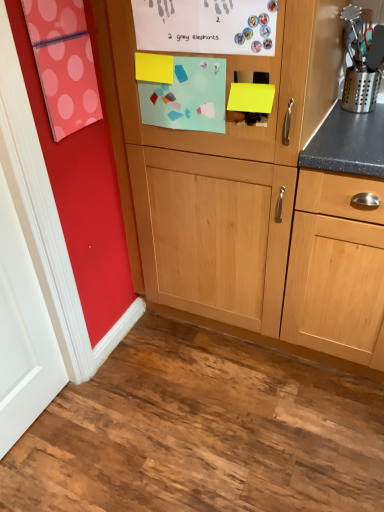
You are a GUI agent. You are given a task and a screenshot of the screen. Output one action in this format:
    pyautogui.click(x=<x>, y=<y>)
    Task: Click on the wooden cabinet at center
    The image size is (384, 512).
    Given the screenshot: What is the action you would take?
    pyautogui.click(x=229, y=167)

What do you see at coordinates (229, 167) in the screenshot?
I see `wooden cabinet at center` at bounding box center [229, 167].

Where is `white matte door at left`? Image resolution: width=384 pixels, height=512 pixels. white matte door at left is located at coordinates (23, 333).

What do you see at coordinates (23, 333) in the screenshot? I see `white matte door at left` at bounding box center [23, 333].

The height and width of the screenshot is (512, 384). What are the coordinates of `wooden cabinet at center` in the screenshot? It's located at (229, 167).

Which object is positioned more to the right, wooden cabinet at center or white matte door at left?

wooden cabinet at center.

Which object is closer to the camera taking this photo, wooden cabinet at center or white matte door at left?

Positioned in front is white matte door at left.

Which is closer to the camera, (126, 9) or (25, 260)?

Positioned in front is point (126, 9).

Looking at this image, from the image's perspective, is wooden cabinet at center above white matte door at left?

Indeed, from the image's perspective, wooden cabinet at center is shown above white matte door at left.

From a real-world perspective, who is located higher, wooden cabinet at center or white matte door at left?

wooden cabinet at center, from a real-world perspective.

Considering the relative sizes of wooden cabinet at center and white matte door at left in the image provided, is wooden cabinet at center thinner than white matte door at left?

Incorrect, the width of wooden cabinet at center is not less than that of white matte door at left.

Is wooden cabinet at center shorter than white matte door at left?

No, wooden cabinet at center is not shorter than white matte door at left.

Considering the sizes of objects wooden cabinet at center and white matte door at left in the image provided, who is bigger, wooden cabinet at center or white matte door at left?

With larger size is wooden cabinet at center.

Consider the image. Would you say wooden cabinet at center is outside white matte door at left?

Yes, wooden cabinet at center is outside of white matte door at left.

Are wooden cabinet at center and white matte door at left located far from each other?

No, wooden cabinet at center is in close proximity to white matte door at left.

Is wooden cabinet at center facing towards white matte door at left?

Yes, wooden cabinet at center is aimed at white matte door at left.

Find the location of a particular element. cabinetry lying above the white matte door at left (from the image's perspective) is located at coordinates (229, 167).

Between white matte door at left and wooden cabinet at center, which one appears on the left side from the viewer's perspective?

From the viewer's perspective, white matte door at left appears more on the left side.

Is the depth of white matte door at left less than that of wooden cabinet at center?

That is True.

Does point (52, 327) come farther from viewer compared to point (311, 19)?

Yes, point (52, 327) is behind point (311, 19).

From the image's perspective, which is above, white matte door at left or wooden cabinet at center?

wooden cabinet at center, from the image's perspective.

From a real-world perspective, is white matte door at left physically below wooden cabinet at center?

Indeed, from a real-world perspective, white matte door at left is positioned beneath wooden cabinet at center.

Which object is thinner, white matte door at left or wooden cabinet at center?

white matte door at left.

Considering the relative sizes of white matte door at left and wooden cabinet at center in the image provided, is white matte door at left taller than wooden cabinet at center?

No.

Does white matte door at left have a smaller size compared to wooden cabinet at center?

Indeed, white matte door at left has a smaller size compared to wooden cabinet at center.

Would you say wooden cabinet at center is part of white matte door at left's contents?

No, wooden cabinet at center is not inside white matte door at left.

Is white matte door at left positioned far away from wooden cabinet at center?

Actually, white matte door at left and wooden cabinet at center are a little close together.

Is white matte door at left oriented towards wooden cabinet at center?

No.

How different are the orientations of white matte door at left and wooden cabinet at center in degrees?

90.1 degrees separate the facing orientations of white matte door at left and wooden cabinet at center.

The width and height of the screenshot is (384, 512). In order to click on door located below the wooden cabinet at center (from the image's perspective) in this screenshot , I will do `click(23, 333)`.

Where is `cabinetry above the white matte door at left (from a real-world perspective)`? cabinetry above the white matte door at left (from a real-world perspective) is located at coordinates (229, 167).

Locate an element on the screen. Image resolution: width=384 pixels, height=512 pixels. cabinetry located behind the white matte door at left is located at coordinates [229, 167].